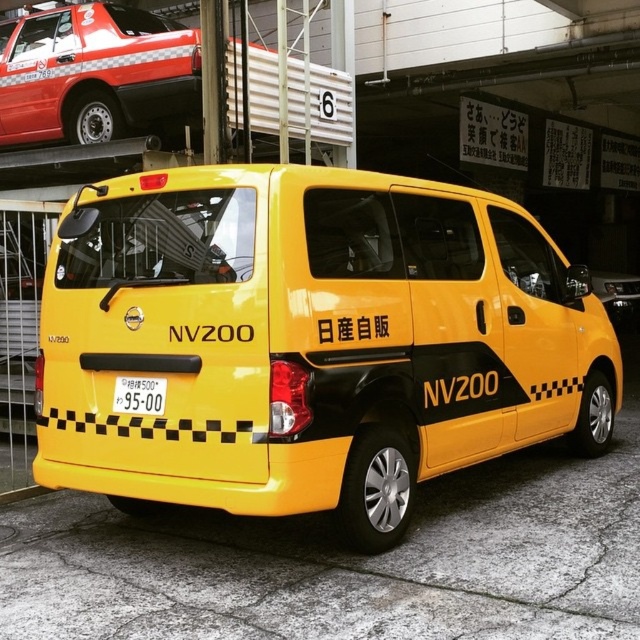
You are a delivery driver who needs to park your van in a specific spot marked at coordinates 0.533, 0.484. Can you confirm if the yellow matte van at center is already occupying that spot?

The yellow matte van at center is positioned exactly at coordinates (x=308, y=340), so it is occupying the spot marked for parking.

You are a delivery person trying to load packages into the yellow matte van at center. There is a matte black taxi at upper left nearby. Can you safely move the packages from the taxi to the van without any obstacles?

The yellow matte van at center is positioned under the matte black taxi at upper left, meaning the taxi is above it. Since the taxi is overhead, there should be no obstruction blocking the path between them, allowing you to safely move the packages.

You are a delivery person trying to park your van in the garage. There is a matte black taxi at upper left. Where should you position your van relative to the taxi to avoid blocking the garage exit?

The matte black taxi at upper left is located at point (92, 72), so you should park your van to the right and behind the taxi to avoid blocking the garage exit.